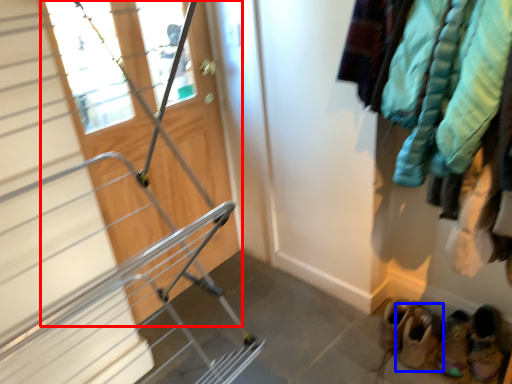
Question: Which object appears farthest to the camera in this image, door (highlighted by a red box) or footwear (highlighted by a blue box)?

Choices:
 (A) door
 (B) footwear

Answer: (B)